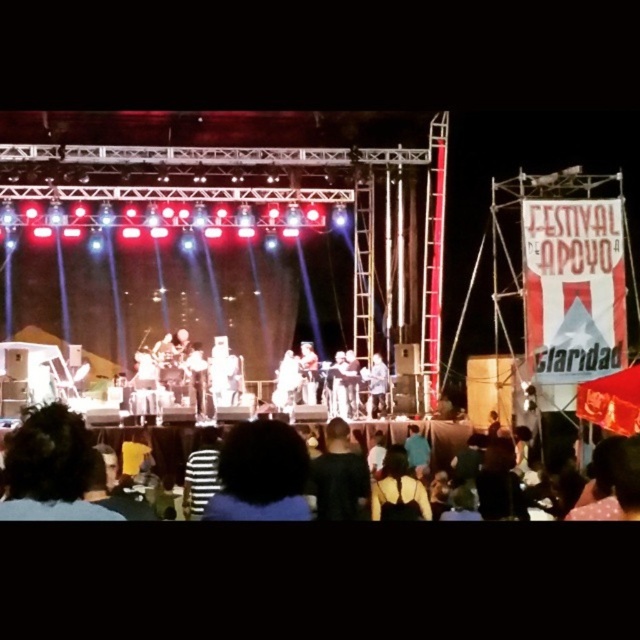
Looking at this image, does smooth skin person at center appear over light brown wooden guitar at center?

Correct, smooth skin person at center is located above light brown wooden guitar at center.

Does smooth skin person at center appear under light brown wooden guitar at center?

Actually, smooth skin person at center is above light brown wooden guitar at center.

Which is behind, point (336, 416) or point (369, 376)?

The point (369, 376) is behind.

The image size is (640, 640). In order to click on smooth skin person at center in this screenshot , I will do `click(337, 387)`.

Who is lower down, smooth skin person at center or dark brown leather jacket at center?

Positioned lower is smooth skin person at center.

Measure the distance from smooth skin person at center to dark brown leather jacket at center.

A distance of 3.86 meters exists between smooth skin person at center and dark brown leather jacket at center.

Image resolution: width=640 pixels, height=640 pixels. What do you see at coordinates (337, 387) in the screenshot? I see `smooth skin person at center` at bounding box center [337, 387].

Image resolution: width=640 pixels, height=640 pixels. I want to click on smooth skin person at center, so click(x=337, y=387).

Who is taller, dark hair at center or white fabric at center?

Standing taller between the two is dark hair at center.

Based on the photo, is dark hair at center above white fabric at center?

No, dark hair at center is not above white fabric at center.

Does point (236, 516) come closer to viewer compared to point (275, 381)?

Yes, point (236, 516) is closer to viewer.

In order to click on dark hair at center in this screenshot , I will do `click(260, 474)`.